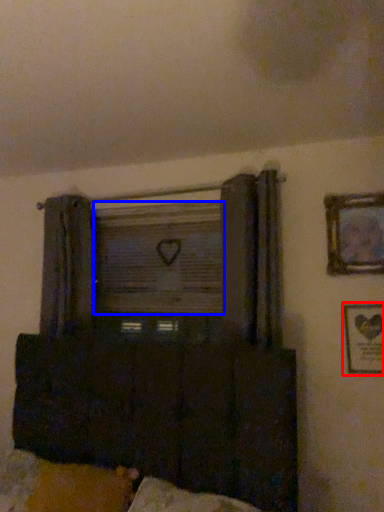
Question: Which point is further to the camera, picture frame (highlighted by a red box) or window screen (highlighted by a blue box)?

Choices:
 (A) picture frame
 (B) window screen

Answer: (B)